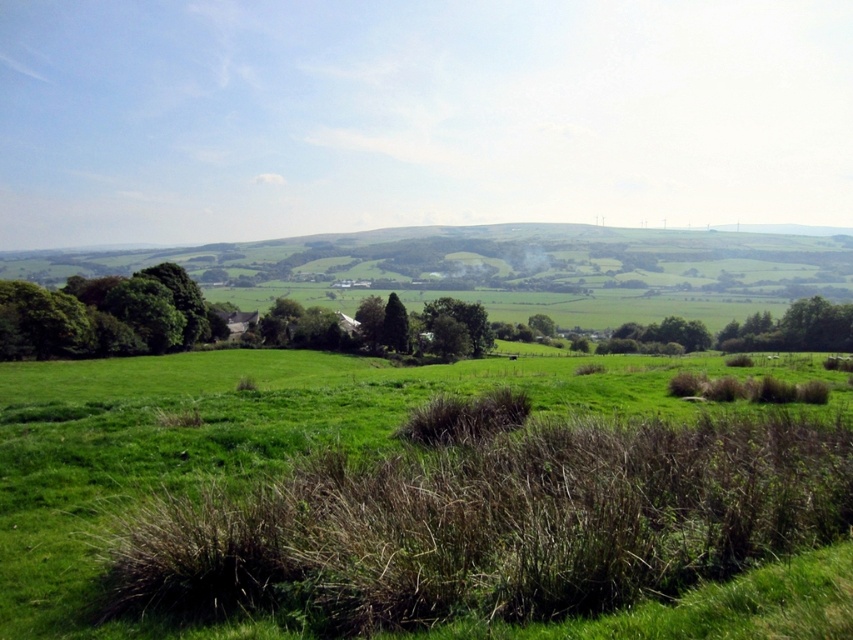
You are standing at the base of the green leafy tree at lower right and want to climb to the top. If you know that the green leafy tree at center is 15 meters tall, can you estimate how tall the tree you are standing under might be?

The green leafy tree at lower right is shorter than the green leafy tree at center, which is 15 meters tall. Therefore, the tree you are standing under is likely less than 15 meters tall.

In the scene shown: You are standing in the rural landscape and want to walk from the point at coordinates point (115, 291) to the point at coordinates point (428, 324). Considering the terrain, which direction should you head to move away from the viewer?

Since point (115, 291) is closer to the viewer than point (428, 324), you should head towards the point at coordinates point (428, 324) by moving away from the viewer.

You are standing in the middle of the field and see the green leafy tree at lower right and the green leafy tree at center. Which tree has a wider spread of branches?

The green leafy tree at lower right has a wider spread of branches than the green leafy tree at center.